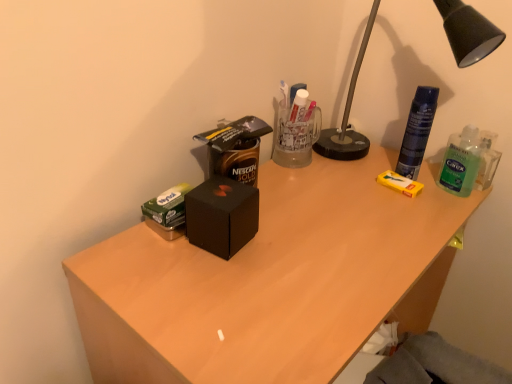
Question: Considering the relative sizes of green translucent hand sanitizer at right and matte black box at center in the image provided, is green translucent hand sanitizer at right thinner than matte black box at center?

Choices:
 (A) no
 (B) yes

Answer: (B)

Question: Does green translucent hand sanitizer at right appear on the right side of matte black box at center?

Choices:
 (A) no
 (B) yes

Answer: (B)

Question: Is green translucent hand sanitizer at right looking in the opposite direction of matte black box at center?

Choices:
 (A) yes
 (B) no

Answer: (B)

Question: Is green translucent hand sanitizer at right next to matte black box at center?

Choices:
 (A) yes
 (B) no

Answer: (B)

Question: Would you say green translucent hand sanitizer at right is a long distance from matte black box at center?

Choices:
 (A) yes
 (B) no

Answer: (B)

Question: Can you confirm if green translucent hand sanitizer at right is shorter than matte black box at center?

Choices:
 (A) yes
 (B) no

Answer: (A)

Question: Is black metal lamp at upper right at the back of matte black box at center?

Choices:
 (A) yes
 (B) no

Answer: (B)

Question: Can you confirm if matte black box at center is wider than black metal lamp at upper right?

Choices:
 (A) yes
 (B) no

Answer: (A)

Question: Can you confirm if matte black box at center is bigger than black metal lamp at upper right?

Choices:
 (A) yes
 (B) no

Answer: (A)

Question: Is matte black box at center not within black metal lamp at upper right?

Choices:
 (A) yes
 (B) no

Answer: (A)

Question: Is matte black box at center smaller than black metal lamp at upper right?

Choices:
 (A) yes
 (B) no

Answer: (B)

Question: Could you tell me if matte black box at center is facing black metal lamp at upper right?

Choices:
 (A) no
 (B) yes

Answer: (A)

Question: Can you confirm if black matte box at center is wider than green translucent hand sanitizer at right?

Choices:
 (A) yes
 (B) no

Answer: (A)